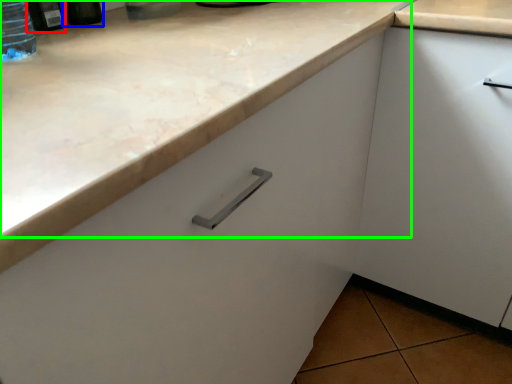
Question: Which object is positioned farthest from bottle (highlighted by a red box)? Select from bottle (highlighted by a blue box) and counter top (highlighted by a green box).

Choices:
 (A) bottle
 (B) counter top

Answer: (B)